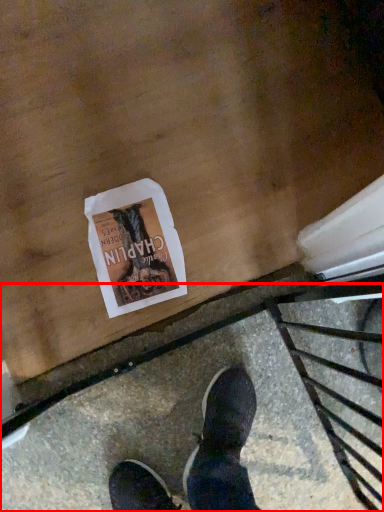
Question: Where is pavement (annotated by the red box) located in relation to flyer in the image?

Choices:
 (A) right
 (B) left

Answer: (A)